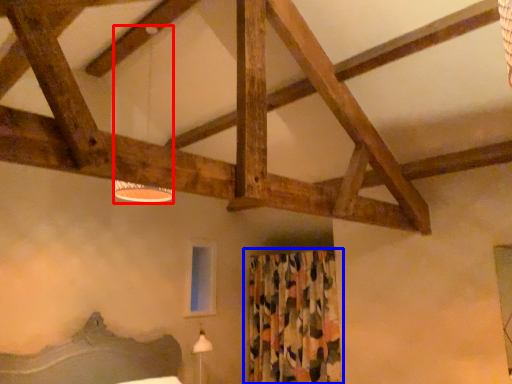
Question: Which object is further to the camera taking this photo, lamp (highlighted by a red box) or curtain (highlighted by a blue box)?

Choices:
 (A) lamp
 (B) curtain

Answer: (B)